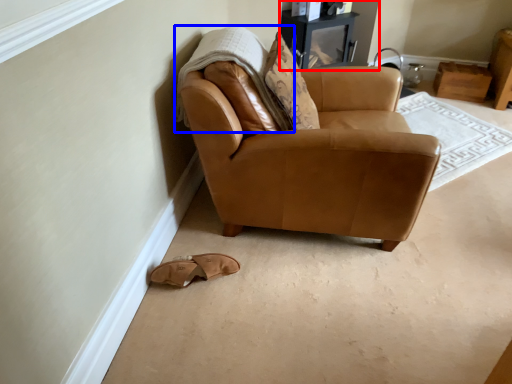
Question: Which point is closer to the camera, entertainment center (highlighted by a red box) or blanket (highlighted by a blue box)?

Choices:
 (A) entertainment center
 (B) blanket

Answer: (B)